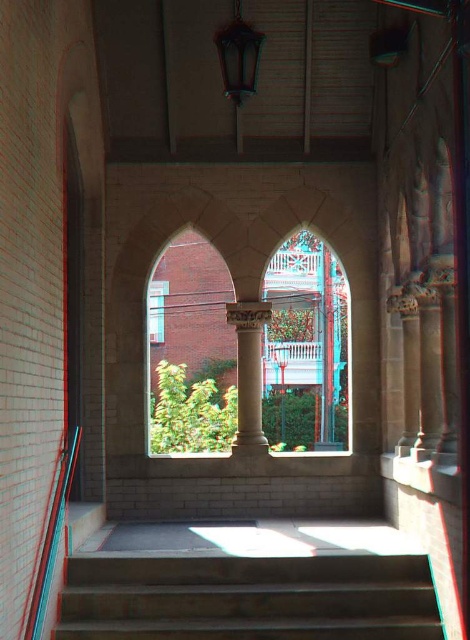
Is point (229, 305) positioned in front of point (33, 588)?

No.

Is point (260, 304) positioned behind point (34, 588)?

Yes, point (260, 304) is farther from viewer.

Find the location of a particular element. white marble column at center is located at coordinates (249, 372).

Is point (417, 564) positioned after point (257, 77)?

No, it is not.

Can you confirm if concrete stairs at lower center is taller than wooden lantern at upper center?

No.

Identify the location of concrete stairs at lower center. (249, 596).

Is point (218, 580) behind point (259, 380)?

That is False.

Can you confirm if concrete stairs at lower center is positioned below white marble column at center?

Correct, concrete stairs at lower center is located below white marble column at center.

Is point (260, 596) positioned behind point (253, 442)?

No, it is in front of (253, 442).

Identify the location of concrete stairs at lower center. The height and width of the screenshot is (640, 470). (249, 596).